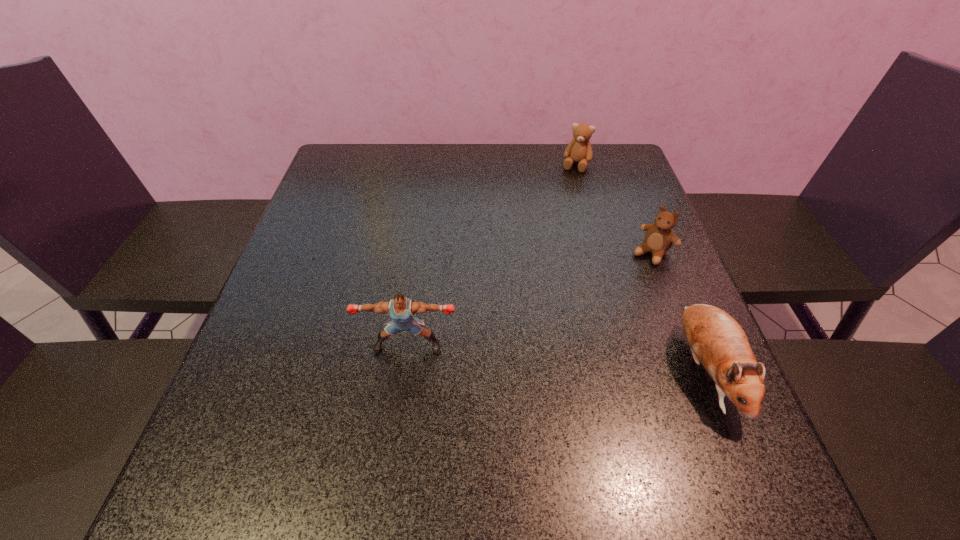
At what (x,y) coordinates should I click in order to perform the action: click on the leftmost object. Please return your answer as a coordinate pair (x, y). Image resolution: width=960 pixels, height=540 pixels. Looking at the image, I should click on (401, 310).

You are a GUI agent. You are given a task and a screenshot of the screen. Output one action in this format:
    pyautogui.click(x=<x>, y=<y>)
    Task: Click on the tallest object
    Image resolution: width=960 pixels, height=540 pixels.
    Given the screenshot: What is the action you would take?
    pyautogui.click(x=401, y=310)

Image resolution: width=960 pixels, height=540 pixels. Find the location of `hamster`. hamster is located at coordinates (716, 339).

The image size is (960, 540). In order to click on the nearer teddy bear in this screenshot , I will do `click(659, 237)`.

At what (x,y) coordinates should I click in order to perform the action: click on the second farthest object. Please return your answer as a coordinate pair (x, y). Looking at the image, I should click on (659, 237).

Identify the location of the left teddy bear. The height and width of the screenshot is (540, 960). (579, 150).

At what (x,y) coordinates should I click in order to perform the action: click on the second object from left to right. Please return your answer as a coordinate pair (x, y). This screenshot has height=540, width=960. Looking at the image, I should click on (579, 150).

This screenshot has height=540, width=960. What are the coordinates of `free spot located on the front-facing side of the tallest object` in the screenshot? It's located at (400, 403).

The height and width of the screenshot is (540, 960). Identify the location of free location located on the front-facing side of the right teddy bear. (597, 315).

At what (x,y) coordinates should I click in order to perform the action: click on free space located on the front-facing side of the right teddy bear. Please return your answer as a coordinate pair (x, y). This screenshot has height=540, width=960. Looking at the image, I should click on (603, 309).